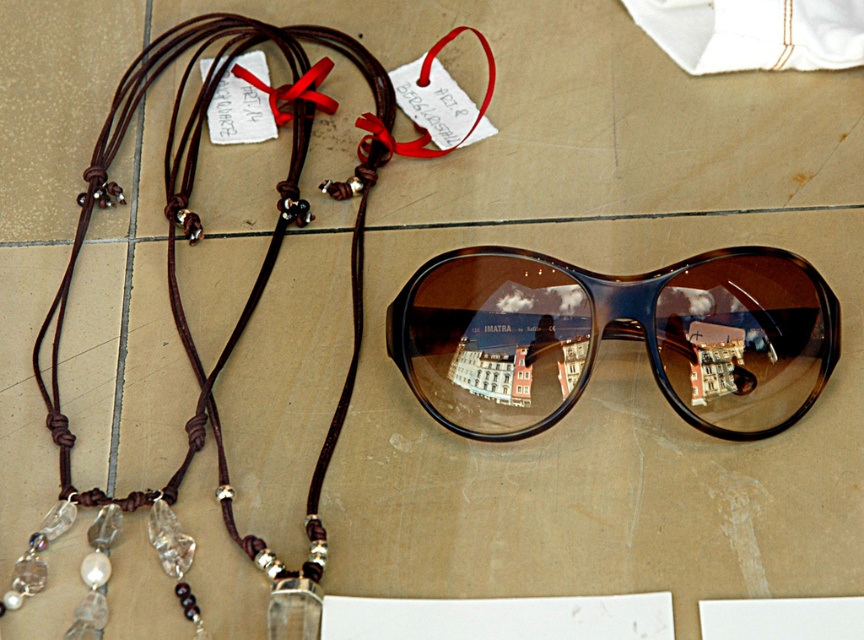
Looking at this image, you are standing in a room and see the brown tortoiseshell sunglasses at center and the brown leather necklace at left. Which object is closer to you?

The brown tortoiseshell sunglasses at center is closer to you because it is further to the viewer than the brown leather necklace at left.

You are arranging items on a table and need to know their sizes. If the brown leather necklace at left is 30 cm long, what is the maximum length the brown tortoiseshell sunglasses at center can be?

The brown tortoiseshell sunglasses at center is shorter than the brown leather necklace at left, which is 30 cm long. Therefore, the maximum length the brown tortoiseshell sunglasses at center can be is just under 30 cm.

You are a photographer standing 1.5 meters away from the camera. You want to adjust your position so that you can see the reflection of the building in the brown tortoiseshell sunglasses at center more clearly. Should you move closer or farther away from the sunglasses?

Answer: The brown tortoiseshell sunglasses at center are currently 1.11 meters from the camera. Since you are standing 1.5 meters away from the camera, you are farther than the sunglasses. To see the reflection more clearly, you should move closer to the sunglasses so that you are within the 1.11 meter distance from the camera.